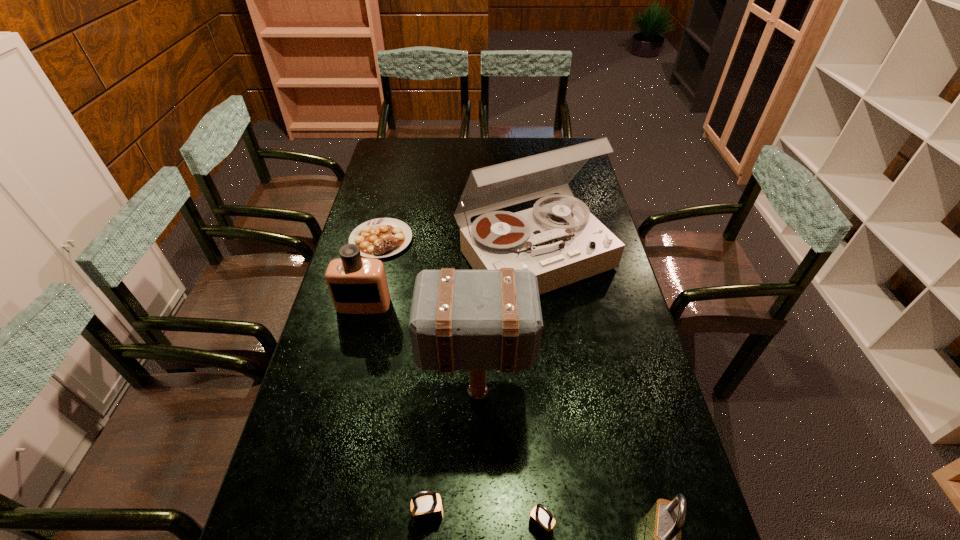
I want to click on free space for a new padlock on the left, so click(320, 504).